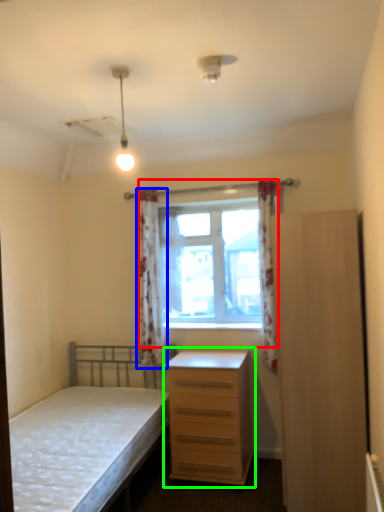
Question: Which object is the closest to the window (highlighted by a red box)? Choose among these: curtain (highlighted by a blue box) or chest of drawers (highlighted by a green box).

Choices:
 (A) curtain
 (B) chest of drawers

Answer: (A)